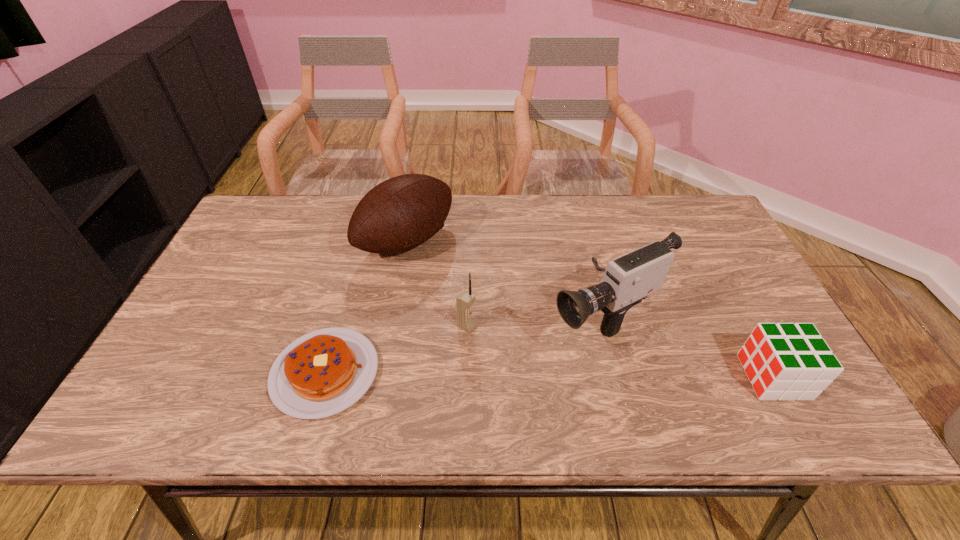
The width and height of the screenshot is (960, 540). Identify the location of object that is at the far edge. (401, 213).

I want to click on pancake that is at the near edge, so click(322, 373).

The width and height of the screenshot is (960, 540). What are the coordinates of `cube located at the near edge` in the screenshot? It's located at (783, 361).

I want to click on camcorder that is at the near edge, so click(x=628, y=279).

Where is `object located at the right edge`? This screenshot has width=960, height=540. object located at the right edge is located at coordinates (783, 361).

You are a GUI agent. You are given a task and a screenshot of the screen. Output one action in this format:
    pyautogui.click(x=<x>, y=<y>)
    Task: Click on the object that is at the near right corner
    The image size is (960, 540).
    Given the screenshot: What is the action you would take?
    coord(783,361)

At what (x,y) coordinates should I click in order to perform the action: click on free region at the far edge. Please return your answer as a coordinate pair (x, y). The width and height of the screenshot is (960, 540). Looking at the image, I should click on (459, 220).

At what (x,y) coordinates should I click in order to perform the action: click on free space at the right edge of the desktop. Please return your answer as a coordinate pair (x, y). This screenshot has width=960, height=540. Looking at the image, I should click on (756, 319).

You are a GUI agent. You are given a task and a screenshot of the screen. Output one action in this format:
    pyautogui.click(x=<x>, y=<y>)
    Task: Click on the vacant space at the far left corner of the desktop
    The height and width of the screenshot is (540, 960).
    Given the screenshot: What is the action you would take?
    pyautogui.click(x=286, y=214)

Locate an element on the screen. free region at the far right corner is located at coordinates (681, 232).